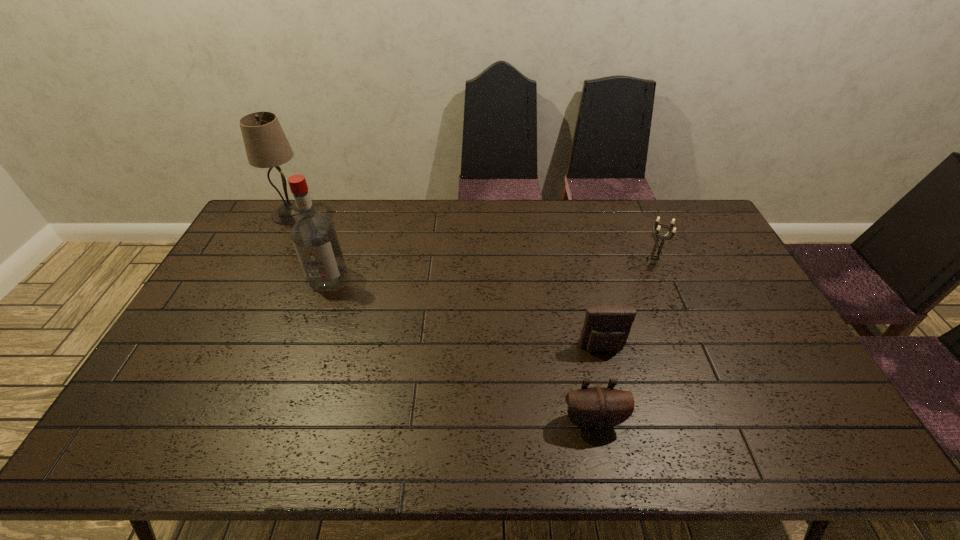
What are the coordinates of `blank region between the farther pouch and the candle holder` in the screenshot? It's located at (628, 305).

This screenshot has width=960, height=540. I want to click on free point between the farther pouch and the lampshade, so click(446, 281).

You are a GUI agent. You are given a task and a screenshot of the screen. Output one action in this format:
    pyautogui.click(x=<x>, y=<y>)
    Task: Click on the empty space that is in between the leftmost object and the fourth farthest object
    The height and width of the screenshot is (540, 960).
    Given the screenshot: What is the action you would take?
    pyautogui.click(x=446, y=281)

Where is `vacant area between the leftmost object and the rightmost object`? The width and height of the screenshot is (960, 540). vacant area between the leftmost object and the rightmost object is located at coordinates (472, 238).

Identify the location of vacant area that lies between the farther pouch and the leftmost object. tap(446, 281).

This screenshot has height=540, width=960. In order to click on free area in between the farther pouch and the rightmost object in this screenshot , I will do `click(628, 305)`.

Find the location of a particular element. vacant space that is in between the farther pouch and the liquor is located at coordinates (465, 313).

Where is `empty location between the lampshade and the rightmost object`? This screenshot has height=540, width=960. empty location between the lampshade and the rightmost object is located at coordinates click(x=472, y=238).

I want to click on free area in between the fourth object from right to left and the fourth farthest object, so click(x=465, y=313).

In order to click on object that is the closest to the candle holder in this screenshot , I will do `click(606, 328)`.